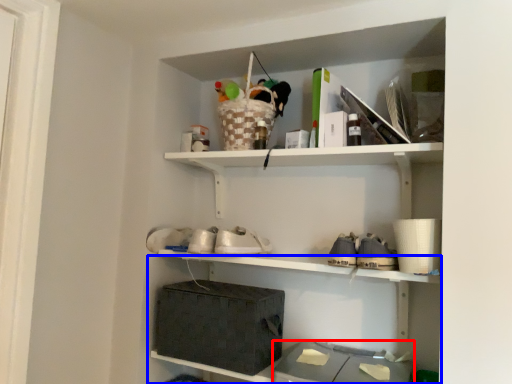
Question: Which of the following is the closest to the observer, storage box (highlighted by a red box) or shelf (highlighted by a blue box)?

Choices:
 (A) storage box
 (B) shelf

Answer: (A)